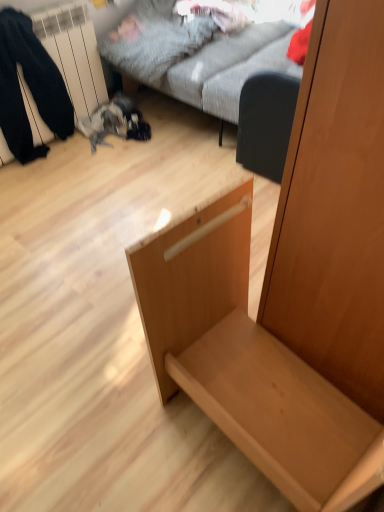
This screenshot has height=512, width=384. I want to click on vacant area situated to the left side of light wood drawer at center, so click(106, 407).